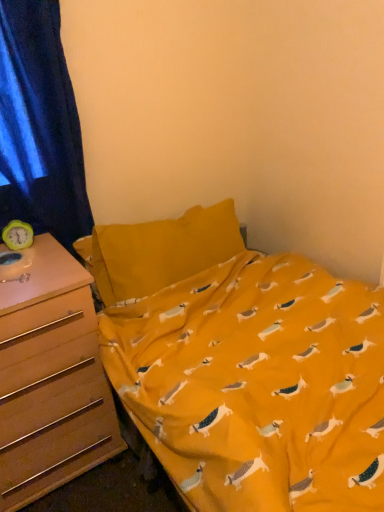
The width and height of the screenshot is (384, 512). Identify the location of blue velvet curtain at left. (39, 126).

This screenshot has height=512, width=384. What do you see at coordinates (39, 126) in the screenshot?
I see `blue velvet curtain at left` at bounding box center [39, 126].

The width and height of the screenshot is (384, 512). What do you see at coordinates (55, 422) in the screenshot? I see `wooden drawer at left` at bounding box center [55, 422].

Where is `wooden drawer at left`? This screenshot has width=384, height=512. wooden drawer at left is located at coordinates (55, 422).

At what (x,y) coordinates should I click in order to perform the action: click on blue velvet curtain at left. Please return your answer as a coordinate pair (x, y). Image resolution: width=384 pixels, height=512 pixels. Looking at the image, I should click on (39, 126).

In the image, is wooden drawer at left on the left side or the right side of blue velvet curtain at left?

From the image, it's evident that wooden drawer at left is to the left of blue velvet curtain at left.

Is wooden drawer at left in front of or behind blue velvet curtain at left in the image?

In the image, wooden drawer at left appears in front of blue velvet curtain at left.

Which point is more forward, (x=41, y=368) or (x=38, y=36)?

The point (x=41, y=368) is closer to the camera.

From the image's perspective, is wooden drawer at left located above or below blue velvet curtain at left?

From the image's perspective, wooden drawer at left appears below blue velvet curtain at left.

From a real-world perspective, is wooden drawer at left physically above blue velvet curtain at left?

No, from a real-world perspective, wooden drawer at left is not above blue velvet curtain at left.

Looking at this image, which object is thinner, wooden drawer at left or blue velvet curtain at left?

blue velvet curtain at left.

In terms of height, does wooden drawer at left look taller or shorter compared to blue velvet curtain at left?

Clearly, wooden drawer at left is shorter compared to blue velvet curtain at left.

Which of these two, wooden drawer at left or blue velvet curtain at left, is smaller?

Smaller between the two is blue velvet curtain at left.

Is wooden drawer at left located outside blue velvet curtain at left?

Yes, wooden drawer at left is not within blue velvet curtain at left.

Is there a large distance between wooden drawer at left and blue velvet curtain at left?

They are positioned close to each other.

Is wooden drawer at left positioned with its back to blue velvet curtain at left?

No, wooden drawer at left is not facing away from blue velvet curtain at left.

Image resolution: width=384 pixels, height=512 pixels. Find the location of `drawer below the blue velvet curtain at left (from the image's perspective)`. drawer below the blue velvet curtain at left (from the image's perspective) is located at coordinates (55, 422).

From the picture: Between blue velvet curtain at left and wooden drawer at left, which one appears on the right side from the viewer's perspective?

blue velvet curtain at left is more to the right.

Between blue velvet curtain at left and wooden drawer at left, which one is positioned behind?

blue velvet curtain at left.

Considering the points (33, 35) and (76, 429), which point is in front, point (33, 35) or point (76, 429)?

The point (33, 35) is closer to the camera.

From the image's perspective, is blue velvet curtain at left above wooden drawer at left?

Yes.

From a real-world perspective, is blue velvet curtain at left located beneath wooden drawer at left?

No, from a real-world perspective, blue velvet curtain at left is not beneath wooden drawer at left.

Which of these two, blue velvet curtain at left or wooden drawer at left, is thinner?

blue velvet curtain at left is thinner.

Looking at this image, does blue velvet curtain at left have a lesser height compared to wooden drawer at left?

Incorrect, the height of blue velvet curtain at left does not fall short of that of wooden drawer at left.

Can you confirm if blue velvet curtain at left is bigger than wooden drawer at left?

No.

Can we say blue velvet curtain at left lies outside wooden drawer at left?

Yes, blue velvet curtain at left is located beyond the bounds of wooden drawer at left.

Is blue velvet curtain at left with wooden drawer at left?

No, blue velvet curtain at left is not with wooden drawer at left.

Is blue velvet curtain at left aimed at wooden drawer at left?

No, blue velvet curtain at left is not turned towards wooden drawer at left.

How different are the orientations of blue velvet curtain at left and wooden drawer at left in degrees?

They differ by 0.2 degrees in their facing directions.

Locate an element on the screen. Image resolution: width=384 pixels, height=512 pixels. curtain located behind the wooden drawer at left is located at coordinates (39, 126).

Where is `curtain above the wooden drawer at left (from the image's perspective)`? The height and width of the screenshot is (512, 384). curtain above the wooden drawer at left (from the image's perspective) is located at coordinates (39, 126).

This screenshot has width=384, height=512. Find the location of `curtain behind the wooden drawer at left`. curtain behind the wooden drawer at left is located at coordinates (39, 126).